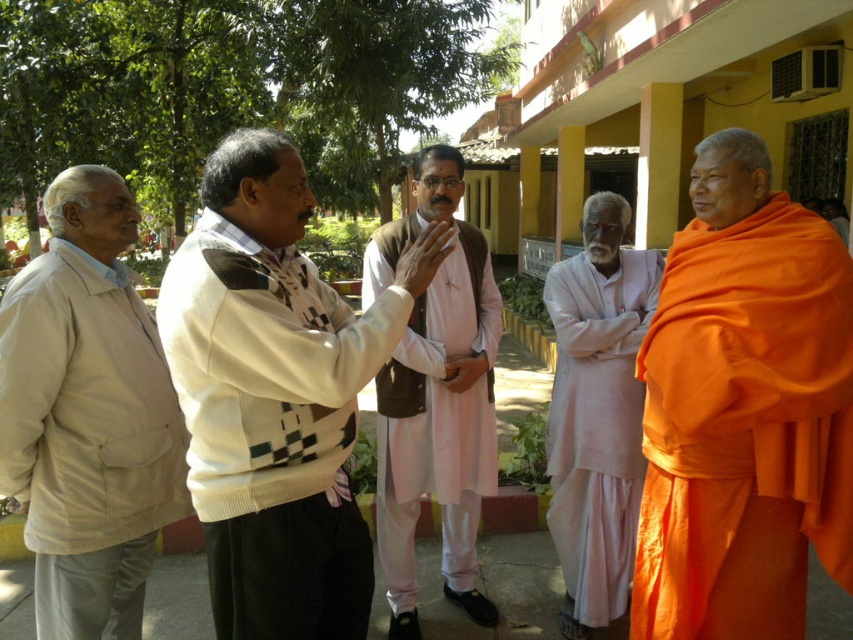
Question: Which of the following is the closest to the observer?

Choices:
 (A) (393, 269)
 (B) (643, 323)
 (C) (761, 356)
 (D) (252, 556)

Answer: (D)

Question: Which object appears closest to the camera in this image?

Choices:
 (A) orange cloth at right
 (B) pink cotton kurta at center
 (C) white knitted sweater at center
 (D) light pink cotton kurta at center

Answer: (C)

Question: Is white knitted sweater at center smaller than light pink cotton kurta at center?

Choices:
 (A) no
 (B) yes

Answer: (A)

Question: Estimate the real-world distances between objects in this image. Which object is farther from the beige cotton jacket at left?

Choices:
 (A) light pink cotton kurta at center
 (B) orange cloth at right
 (C) white knitted sweater at center
 (D) pink cotton kurta at center

Answer: (B)

Question: Can you confirm if white knitted sweater at center is positioned above beige cotton jacket at left?

Choices:
 (A) no
 (B) yes

Answer: (B)

Question: Observing the image, what is the correct spatial positioning of beige cotton jacket at left in reference to pink cotton kurta at center?

Choices:
 (A) above
 (B) below

Answer: (B)